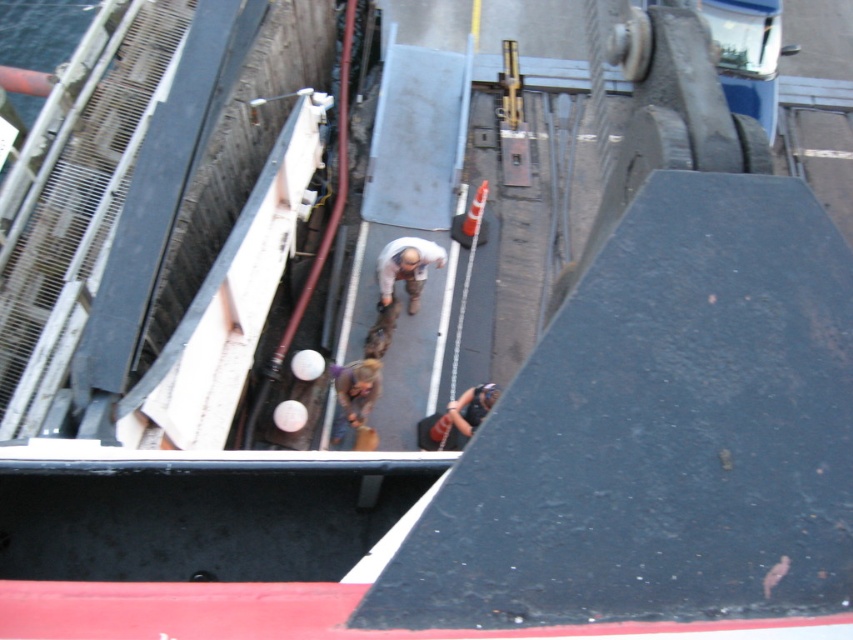
Question: Does light brown fabric pants at center lie in front of brown leather jacket at center?

Choices:
 (A) no
 (B) yes

Answer: (A)

Question: Which is farther from the matte black helmet at upper center?

Choices:
 (A) brown leather jacket at center
 (B) light brown fabric pants at center

Answer: (B)

Question: Estimate the real-world distances between objects in this image. Which object is farther from the brown leather jacket at center?

Choices:
 (A) matte black helmet at upper center
 (B) light brown fabric pants at center

Answer: (B)

Question: Can you confirm if brown leather jacket at center is thinner than matte black helmet at upper center?

Choices:
 (A) yes
 (B) no

Answer: (B)

Question: Which object is positioned closest to the light brown fabric pants at center?

Choices:
 (A) brown leather jacket at center
 (B) matte black helmet at upper center

Answer: (A)

Question: Considering the relative positions of light brown fabric pants at center and matte black helmet at upper center in the image provided, where is light brown fabric pants at center located with respect to matte black helmet at upper center?

Choices:
 (A) above
 (B) below

Answer: (A)